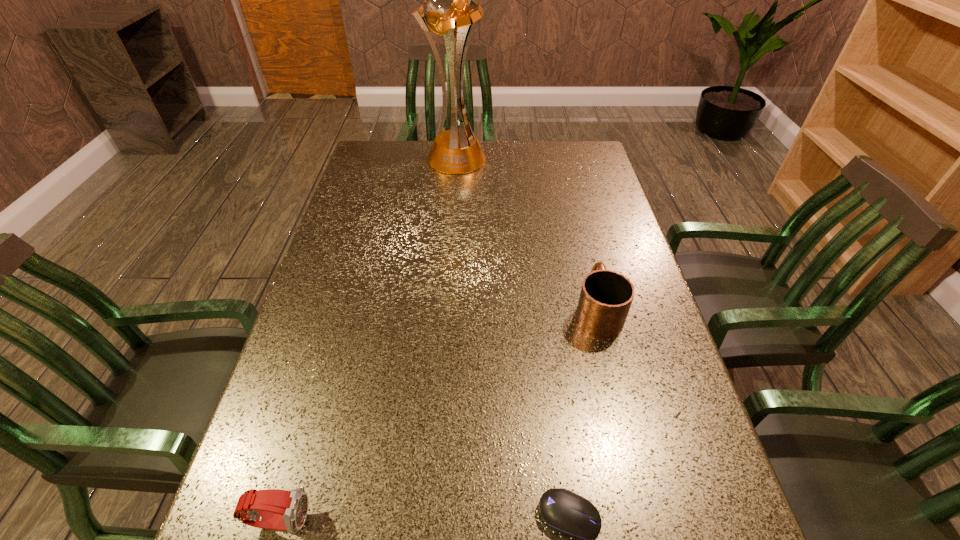
This screenshot has height=540, width=960. In the image, there is a desktop. In order to click on vacant space at the far edge in this screenshot , I will do `click(526, 171)`.

Where is `vacant position at the left edge of the desktop`? This screenshot has width=960, height=540. vacant position at the left edge of the desktop is located at coordinates (275, 436).

Where is `free spot at the right edge of the desktop`? The width and height of the screenshot is (960, 540). free spot at the right edge of the desktop is located at coordinates (574, 218).

Where is `vacant space at the far left corner`? vacant space at the far left corner is located at coordinates click(x=379, y=161).

In the image, there is a desktop. At what (x,y) coordinates should I click in order to perform the action: click on vacant space at the far right corner. Please return your answer as a coordinate pair (x, y). Looking at the image, I should click on (553, 152).

Where is `free area in between the third nearest object and the tallest object`? This screenshot has height=540, width=960. free area in between the third nearest object and the tallest object is located at coordinates pos(526,234).

In order to click on blank region between the trophy and the rightmost object in this screenshot , I will do `click(526, 234)`.

Locate an element on the screen. free space between the farthest object and the second farthest object is located at coordinates (526, 234).

Identify the location of the closest object to the computer mouse. The height and width of the screenshot is (540, 960). (x=606, y=296).

You are a GUI agent. You are given a task and a screenshot of the screen. Output one action in this format:
    pyautogui.click(x=<x>, y=<y>)
    Task: Click on the object that stands as the third closest to the watch
    This screenshot has height=540, width=960.
    Given the screenshot: What is the action you would take?
    pyautogui.click(x=450, y=9)